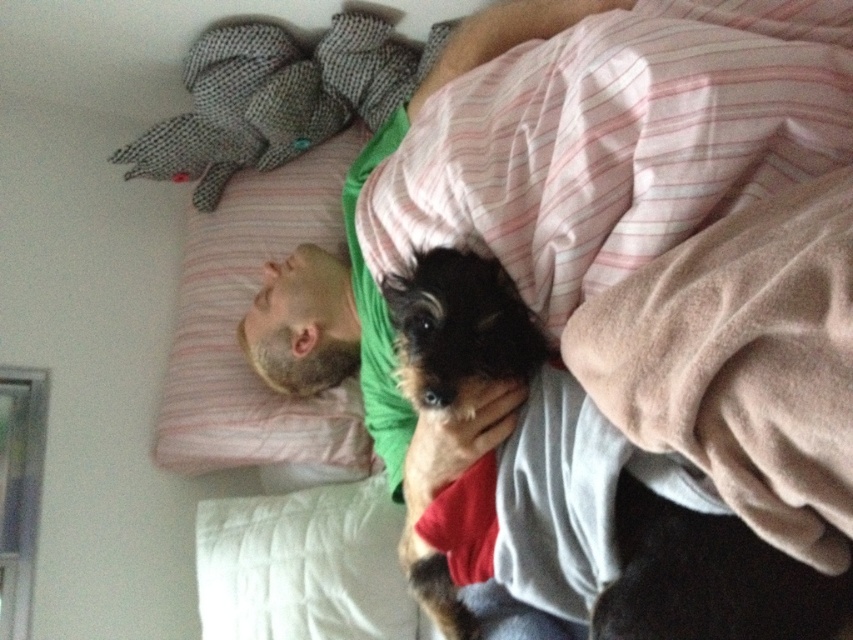
You are a photographer trying to capture the shaggy brown dog at center without the beige soft blanket at upper right blocking the view. Can you move the blanket to the side to get a clear shot?

The beige soft blanket at upper right is in front of the shaggy brown dog at center, so moving the blanket to the side would allow you to get a clear shot of the shaggy brown dog at center.

You are a delivery robot trying to place a small package between the beige soft blanket at upper right and the pink striped pillow at upper left on the bed. Can you fit the package if it measures 30 inches in length?

The distance between the beige soft blanket at upper right and the pink striped pillow at upper left is 34.10 inches. Since the package is 30 inches long, it can fit between them as there is enough space.

In the scene shown: You are a photographer setting up a shot of the scene. You want to ensure the shaggy brown dog at center and the pink striped pillow at upper left are both visible in the frame. Based on their positions, which object is closer to the bottom of the image?

The shaggy brown dog at center is located below the pink striped pillow at upper left, so the dog is closer to the bottom of the image.